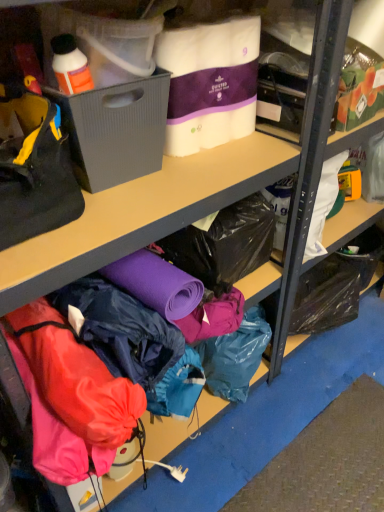
Question: From a real-world perspective, is gray plastic bin at left under black fabric handbag at left?

Choices:
 (A) yes
 (B) no

Answer: (A)

Question: Is gray plastic bin at left not close to black fabric handbag at left?

Choices:
 (A) no
 (B) yes

Answer: (A)

Question: Considering the relative positions of gray plastic bin at left and black fabric handbag at left in the image provided, is gray plastic bin at left in front of black fabric handbag at left?

Choices:
 (A) no
 (B) yes

Answer: (A)

Question: Can you confirm if gray plastic bin at left is shorter than black fabric handbag at left?

Choices:
 (A) no
 (B) yes

Answer: (B)

Question: Is gray plastic bin at left wider than black fabric handbag at left?

Choices:
 (A) no
 (B) yes

Answer: (A)

Question: From a real-world perspective, is gray plastic bin at left on top of black fabric handbag at left?

Choices:
 (A) no
 (B) yes

Answer: (A)

Question: Are gray plastic bin at left and white quilted paper towels at upper center, the 2th clothing when ordered from bottom to top, beside each other?

Choices:
 (A) yes
 (B) no

Answer: (B)

Question: Is gray plastic bin at left oriented towards white quilted paper towels at upper center, the 2th clothing when ordered from bottom to top?

Choices:
 (A) yes
 (B) no

Answer: (B)

Question: From the image's perspective, is gray plastic bin at left under white quilted paper towels at upper center, the 2th clothing when ordered from bottom to top?

Choices:
 (A) no
 (B) yes

Answer: (B)

Question: Would you consider gray plastic bin at left to be distant from white quilted paper towels at upper center, the 2th clothing when ordered from bottom to top?

Choices:
 (A) yes
 (B) no

Answer: (B)

Question: From a real-world perspective, is gray plastic bin at left over white quilted paper towels at upper center, the 2th clothing when ordered from bottom to top?

Choices:
 (A) no
 (B) yes

Answer: (A)

Question: Is gray plastic bin at left outside white quilted paper towels at upper center, the 2th clothing when ordered from bottom to top?

Choices:
 (A) yes
 (B) no

Answer: (A)

Question: Can you confirm if black fabric handbag at left is smaller than white quilted paper towels at upper center, the 1th clothing when ordered from top to bottom?

Choices:
 (A) no
 (B) yes

Answer: (A)